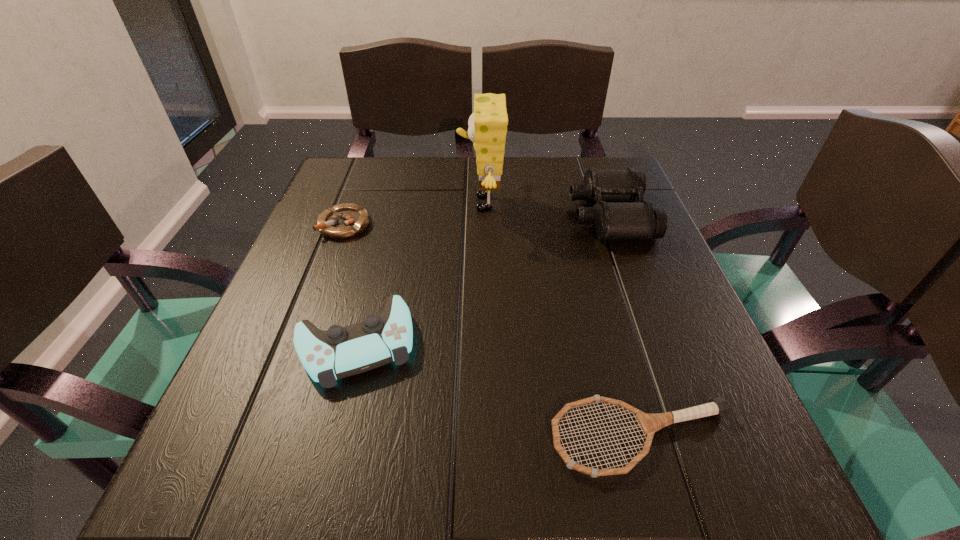
The image size is (960, 540). Identify the location of free space that is in between the third tallest object and the nearest object. (499, 391).

Locate an element on the screen. The width and height of the screenshot is (960, 540). object that is the fourth nearest to the binoculars is located at coordinates point(343,221).

Choose which object is the fourth nearest neighbor to the sponge. Please provide its 2D coordinates. Your answer should be formatted as a tuple, i.e. [(x, y)], where the tuple contains the x and y coordinates of a point satisfying the conditions above.

[(649, 423)]

Locate an element on the screen. free space that satisfies the following two spatial constraints: 1. on the back side of the nearest object; 2. on the front-facing side of the third object from right to left is located at coordinates point(576,203).

In order to click on vacant space that satisfies the following two spatial constraints: 1. on the back side of the nearest object; 2. on the front-facing side of the third object from right to left in this screenshot , I will do `click(576, 203)`.